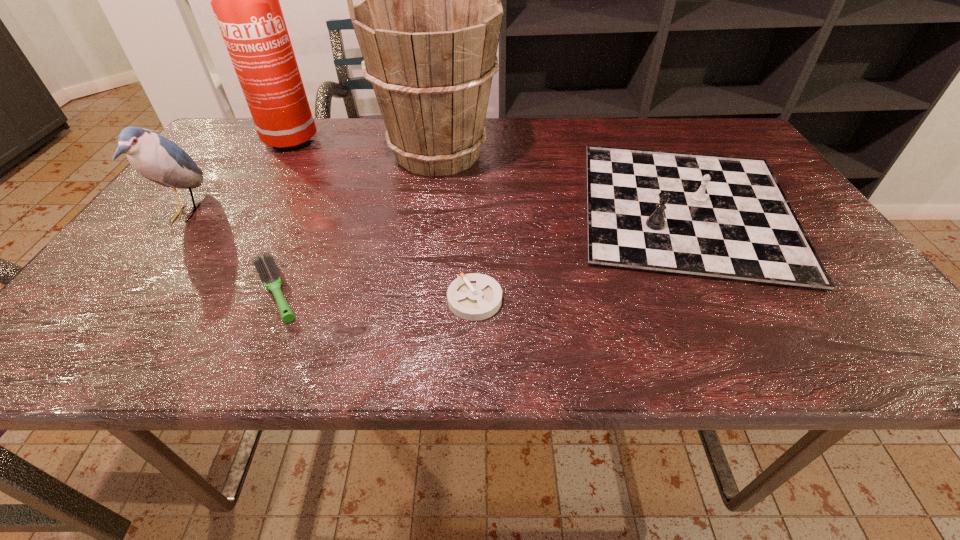
At what (x,y) coordinates should I click in order to perform the action: click on fire extinguisher. Please return your answer as a coordinate pair (x, y). Looking at the image, I should click on (245, 0).

Identify the location of the fifth shortest object. This screenshot has width=960, height=540. (428, 24).

What are the coordinates of `bird` in the screenshot? It's located at pyautogui.click(x=155, y=157).

At what (x,y) coordinates should I click in order to perform the action: click on the rightmost object. Please return your answer as a coordinate pair (x, y). Looking at the image, I should click on (721, 217).

The height and width of the screenshot is (540, 960). Identify the location of gameboard. (721, 217).

Locate an element on the screen. The image size is (960, 540). hairbrush is located at coordinates (267, 269).

What are the coordinates of `the second shortest object` in the screenshot? It's located at (267, 269).

Find the location of `the shortest object`. the shortest object is located at coordinates (474, 296).

At what (x,y) coordinates should I click in order to perform the action: click on vacant area situated at the nozzle of the fire extinguisher. Please return your answer as a coordinate pair (x, y). Looking at the image, I should click on (400, 140).

This screenshot has width=960, height=540. Find the location of `vacant space positioned on the right of the fifth shortest object`. vacant space positioned on the right of the fifth shortest object is located at coordinates (517, 153).